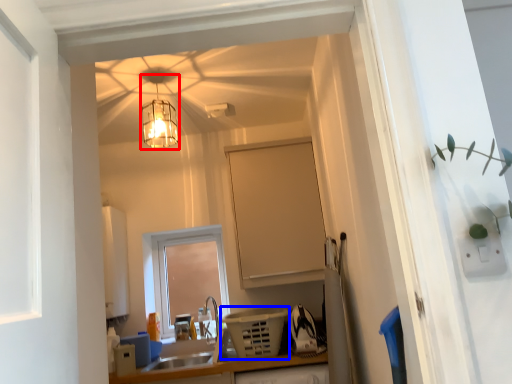
Question: Which of the following is the closest to the observer, lamp (highlighted by a red box) or appliance (highlighted by a blue box)?

Choices:
 (A) lamp
 (B) appliance

Answer: (A)